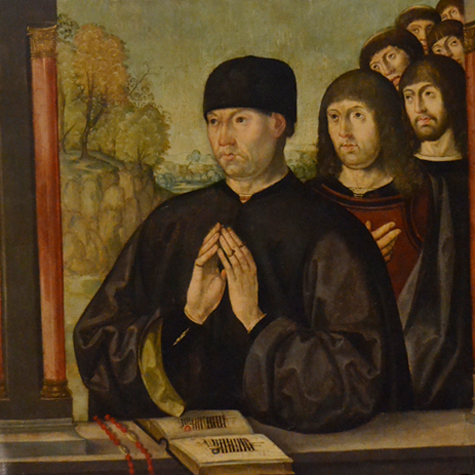
Locate an element on the screen. This screenshot has width=475, height=475. painted column is located at coordinates (51, 244).